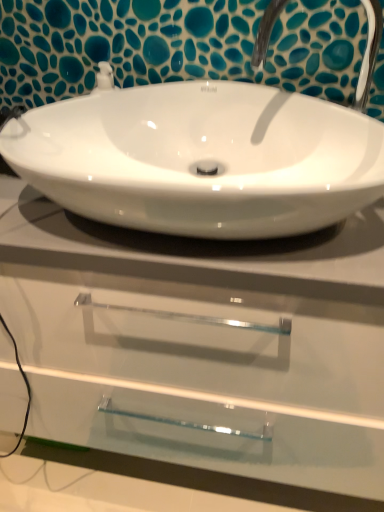
Question: Does white glossy sink at center have a greater height compared to white glossy countertop at center?

Choices:
 (A) no
 (B) yes

Answer: (A)

Question: Is white glossy sink at center bigger than white glossy countertop at center?

Choices:
 (A) yes
 (B) no

Answer: (B)

Question: Is white glossy sink at center positioned in front of white glossy countertop at center?

Choices:
 (A) yes
 (B) no

Answer: (A)

Question: From the image's perspective, does white glossy sink at center appear lower than white glossy countertop at center?

Choices:
 (A) yes
 (B) no

Answer: (B)

Question: Is white glossy sink at center positioned beyond the bounds of white glossy countertop at center?

Choices:
 (A) no
 (B) yes

Answer: (B)

Question: From the image's perspective, is white glossy sink at center located above or below white glossy countertop at center?

Choices:
 (A) below
 (B) above

Answer: (B)

Question: Considering the positions of white glossy sink at center and white glossy countertop at center in the image, is white glossy sink at center bigger or smaller than white glossy countertop at center?

Choices:
 (A) big
 (B) small

Answer: (B)

Question: In the image, is white glossy sink at center positioned in front of or behind white glossy countertop at center?

Choices:
 (A) front
 (B) behind

Answer: (A)

Question: Based on their positions, is white glossy sink at center located to the left or right of white glossy countertop at center?

Choices:
 (A) left
 (B) right

Answer: (B)

Question: In terms of width, does white glossy countertop at center look wider or thinner when compared to white glossy sink at center?

Choices:
 (A) thin
 (B) wide

Answer: (B)

Question: From the image's perspective, relative to white glossy sink at center, is white glossy countertop at center above or below?

Choices:
 (A) below
 (B) above

Answer: (A)

Question: In terms of height, does white glossy countertop at center look taller or shorter compared to white glossy sink at center?

Choices:
 (A) short
 (B) tall

Answer: (B)

Question: Relative to white glossy sink at center, is white glossy countertop at center in front or behind?

Choices:
 (A) behind
 (B) front

Answer: (A)

Question: Considering their positions, is satin nickel faucet at upper center located in front of or behind white glossy sink at center?

Choices:
 (A) behind
 (B) front

Answer: (A)

Question: Looking at their shapes, would you say satin nickel faucet at upper center is wider or thinner than white glossy sink at center?

Choices:
 (A) thin
 (B) wide

Answer: (A)